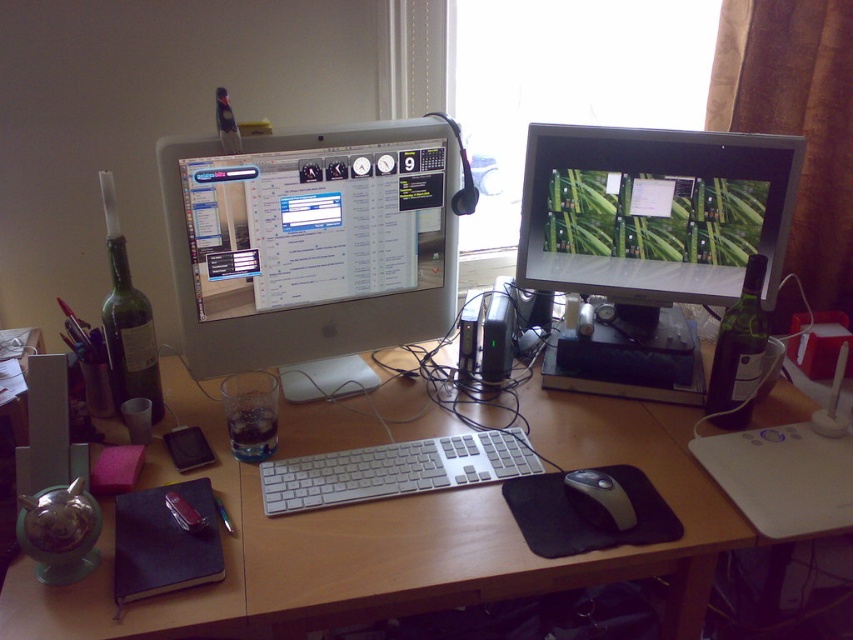
Who is taller, dark glass bottle at right or green matte bottle at left?

green matte bottle at left

In order to click on dark glass bottle at right in this screenshot , I will do `click(738, 353)`.

Locate an element on the screen. This screenshot has width=853, height=640. dark glass bottle at right is located at coordinates (738, 353).

Is point (299, 500) closer to viewer compared to point (160, 380)?

Yes, it is in front of point (160, 380).

The width and height of the screenshot is (853, 640). What do you see at coordinates (395, 470) in the screenshot?
I see `white aluminum keyboard at center` at bounding box center [395, 470].

At what (x,y) coordinates should I click in order to perform the action: click on white aluminum keyboard at center. Please return your answer as a coordinate pair (x, y). This screenshot has width=853, height=640. Looking at the image, I should click on (395, 470).

Between point (264, 368) and point (132, 384), which one is positioned behind?

The point (264, 368) is more distant.

Consider the image. Does satin silver monitor at center have a greater height compared to green matte bottle at left?

Yes, satin silver monitor at center is taller than green matte bottle at left.

Who is more distant from viewer, (199, 248) or (149, 324)?

Positioned behind is point (149, 324).

At what (x,y) coordinates should I click in order to perform the action: click on satin silver monitor at center. Please return your answer as a coordinate pair (x, y). Looking at the image, I should click on (312, 241).